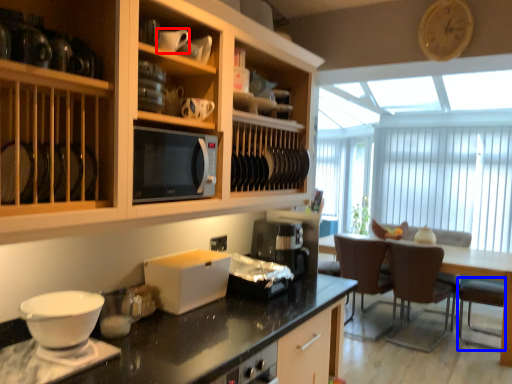
Question: Which object is closer to the camera taking this photo, tableware (highlighted by a red box) or armchair (highlighted by a blue box)?

Choices:
 (A) tableware
 (B) armchair

Answer: (A)